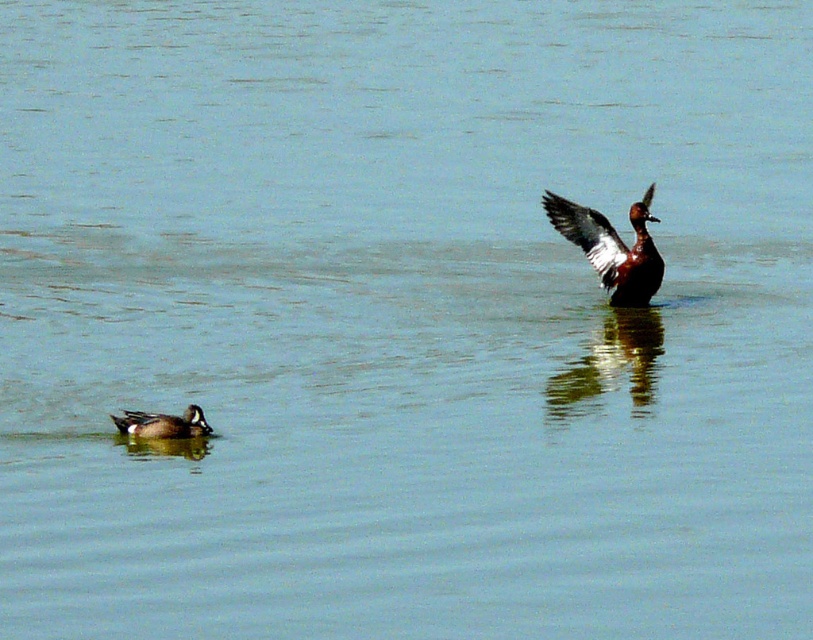
Question: Which point appears closest to the camera in this image?

Choices:
 (A) (589, 234)
 (B) (553, 204)
 (C) (193, 412)

Answer: (C)

Question: Among these objects, which one is farthest from the camera?

Choices:
 (A) shiny brown wing at upper right
 (B) greenish-gray feathers duck at lower left

Answer: (A)

Question: Does shiny brown wing at upper right appear over greenish-gray feathers duck at lower left?

Choices:
 (A) no
 (B) yes

Answer: (B)

Question: Can you confirm if shiny brown wing at upper right is positioned below greenish-gray feathers duck at lower left?

Choices:
 (A) yes
 (B) no

Answer: (B)

Question: From the image, what is the correct spatial relationship of brown glossy duck at upper right in relation to greenish-gray feathers duck at lower left?

Choices:
 (A) below
 (B) above

Answer: (B)

Question: Which point is closer to the camera taking this photo?

Choices:
 (A) (650, 252)
 (B) (546, 204)
 (C) (192, 417)

Answer: (C)